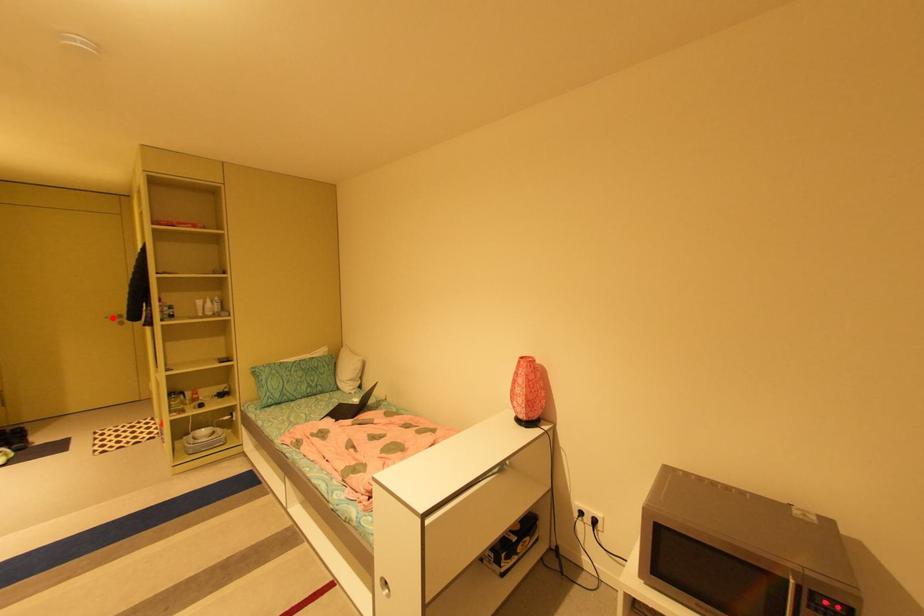
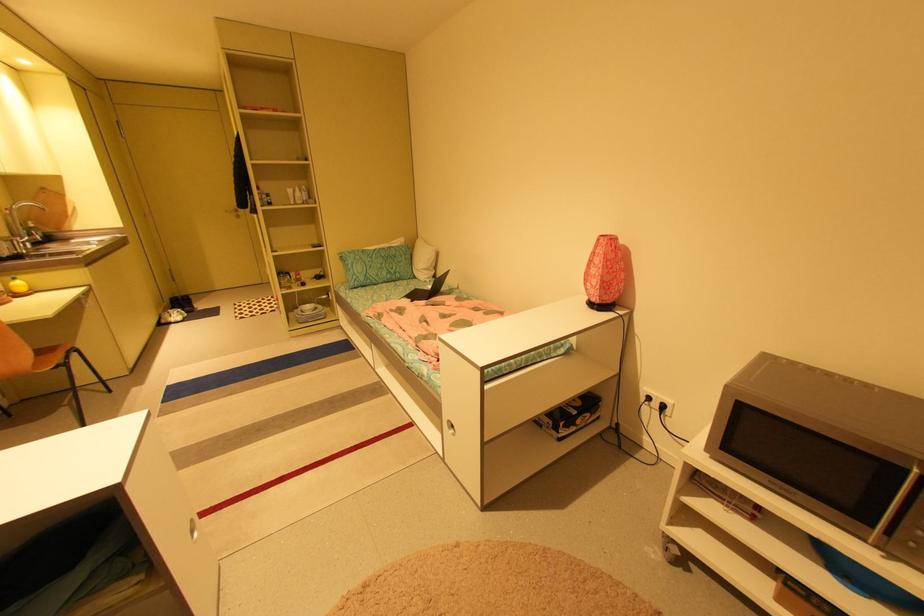
Question: I am providing you with two images of the same scene from different viewpoints. A red point is marked on the first image. Can you still see the location of the red point in image 2?

Choices:
 (A) Yes
 (B) No

Answer: (A)